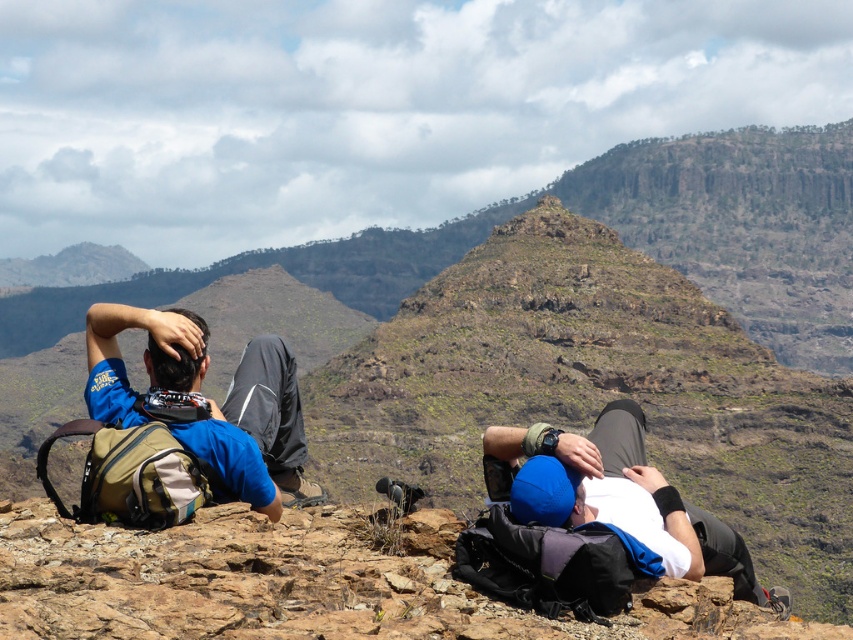
Question: Does blue fabric cap at center have a greater width compared to matte blue shirt at left?

Choices:
 (A) yes
 (B) no

Answer: (B)

Question: Among these points, which one is farthest from the camera?

Choices:
 (A) (555, 458)
 (B) (274, 484)

Answer: (B)

Question: Can you confirm if blue fabric cap at center is positioned to the left of matte blue shirt at left?

Choices:
 (A) yes
 (B) no

Answer: (B)

Question: Among these points, which one is nearest to the camera?

Choices:
 (A) (148, 364)
 (B) (624, 461)

Answer: (A)

Question: Can you confirm if blue fabric cap at center is thinner than matte blue shirt at left?

Choices:
 (A) yes
 (B) no

Answer: (A)